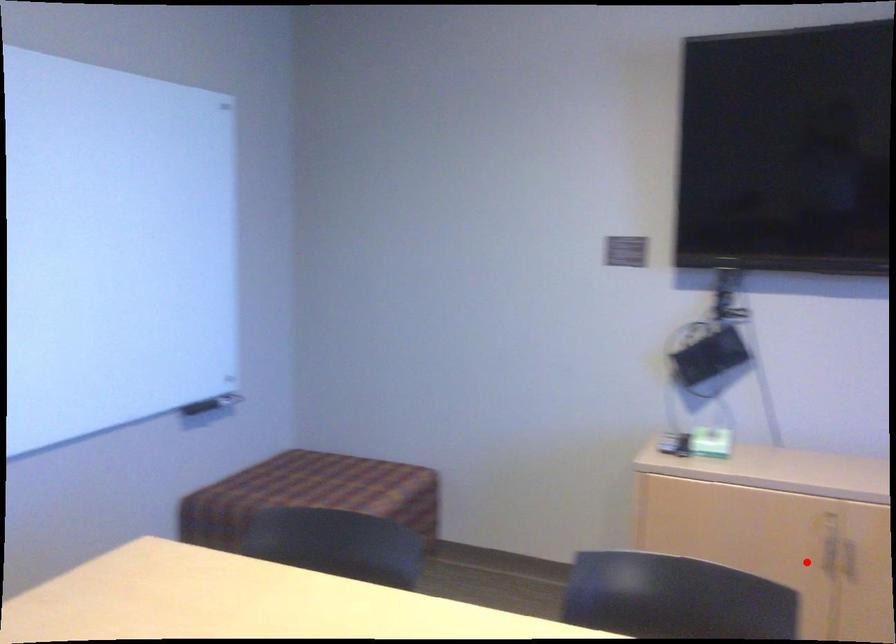
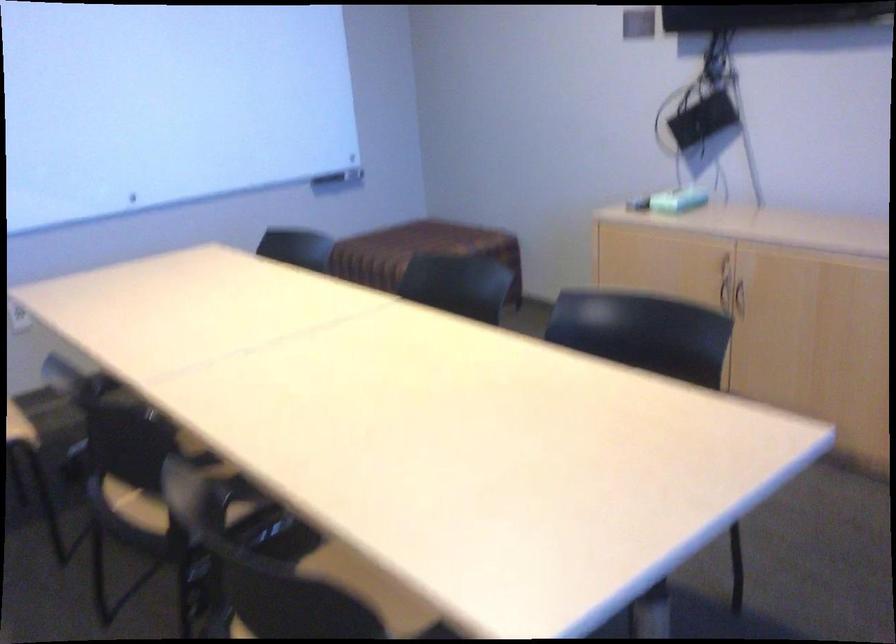
Question: I am providing you with two images of the same scene from different viewpoints. Given a red point in image1, look at the same physical point in image2. Is it:

Choices:
 (A) Closer to the viewpoint
 (B) Farther from the viewpoint

Answer: (B)